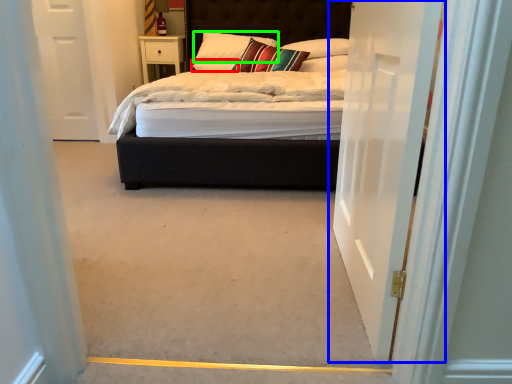
Question: Which object is positioned farthest from pillow (highlighted by a red box)? Select from door (highlighted by a blue box) and pillow (highlighted by a green box).

Choices:
 (A) door
 (B) pillow

Answer: (A)